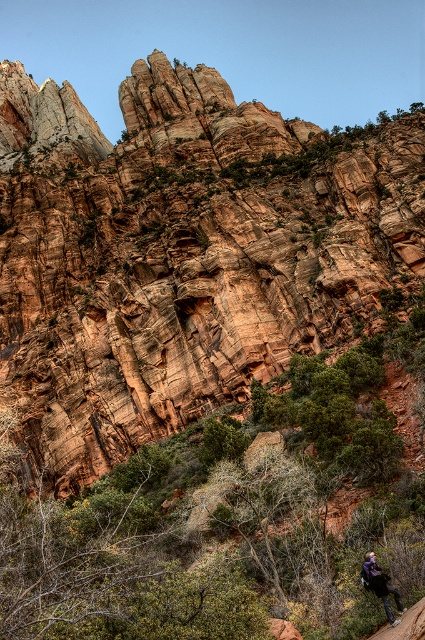
The height and width of the screenshot is (640, 425). I want to click on rustic rock formation at center, so click(x=181, y=253).

Can you confirm if rustic rock formation at center is taller than purple fabric backpack at lower right?

Yes.

What are the coordinates of `rustic rock formation at center` in the screenshot? It's located at (181, 253).